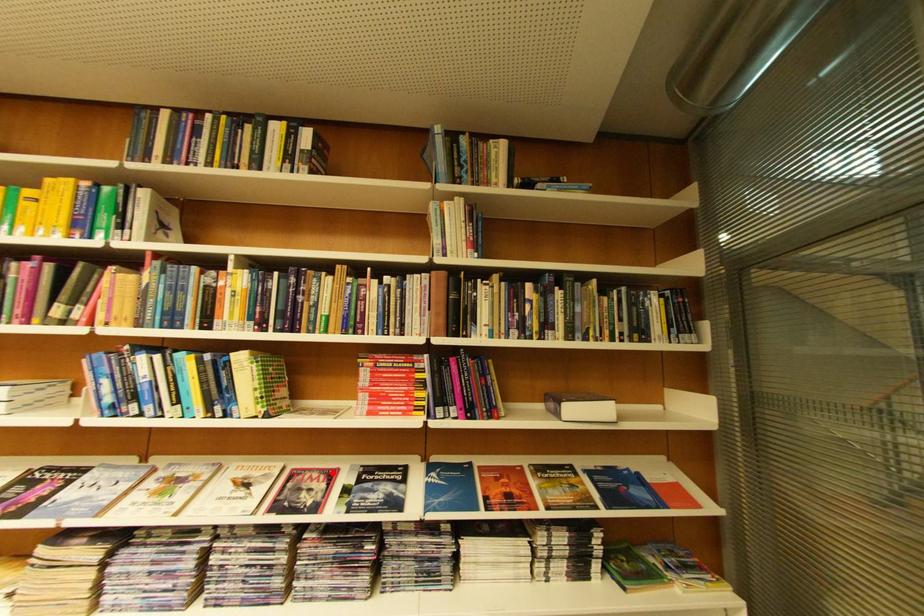
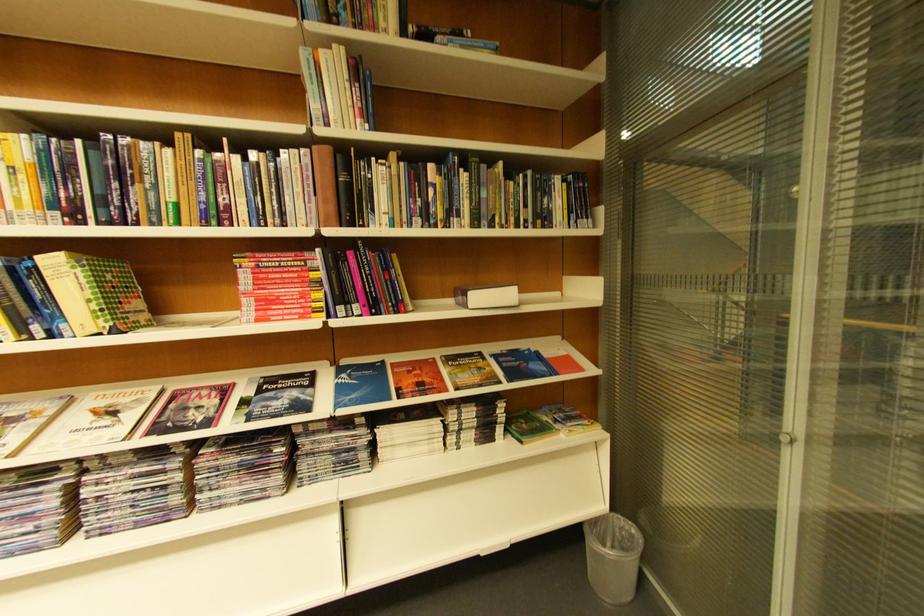
In the second image, find the point that corresponds to the highlighted location in the first image.

(224, 389)